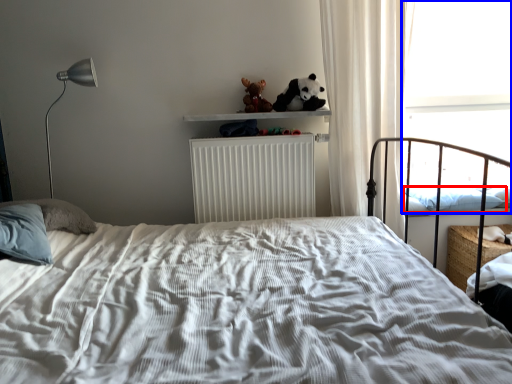
Question: Which object is closer to the camera taking this photo, pillow (highlighted by a red box) or window screen (highlighted by a blue box)?

Choices:
 (A) pillow
 (B) window screen

Answer: (A)